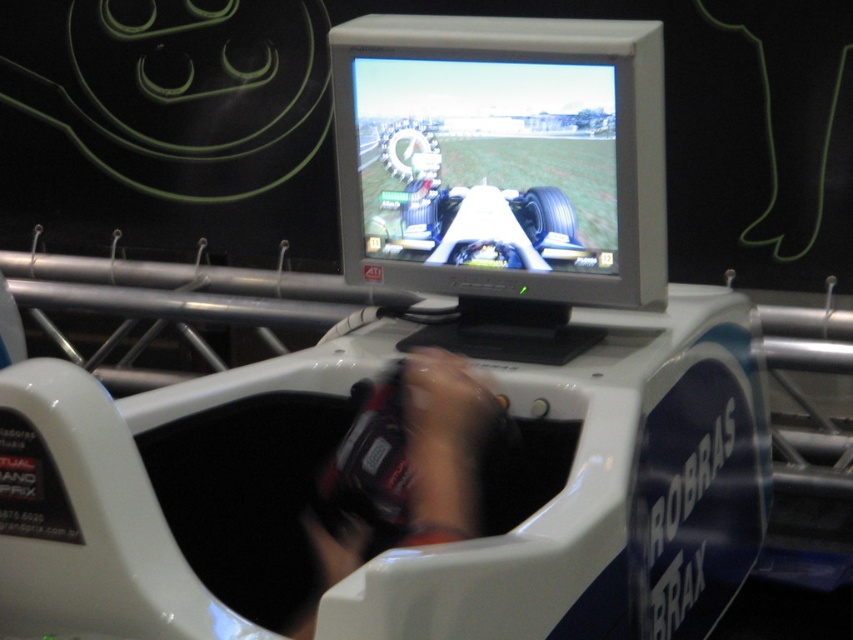
You are setting up a racing simulator and need to place the matte silver monitor at center and the smooth black controller at center on a shelf. If the shelf has a width of 1 meter, can both items fit side by side without overlapping?

The matte silver monitor at center might be wider than the smooth black controller at center. Since the shelf is 1 meter wide, it depends on their combined widths. If the monitor is wider, the total width could exceed 1 meter, so they might not fit. Check their exact dimensions to confirm.